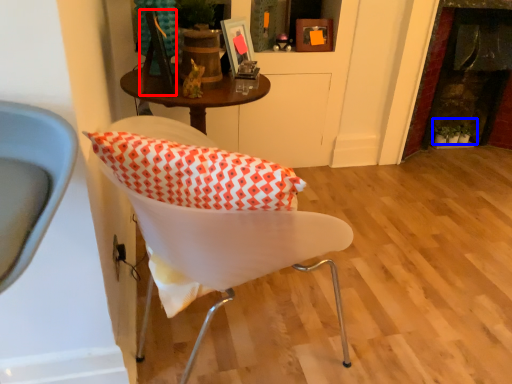
Question: Which object appears farthest to the camera in this image, picture frame (highlighted by a red box) or plant (highlighted by a blue box)?

Choices:
 (A) picture frame
 (B) plant

Answer: (B)